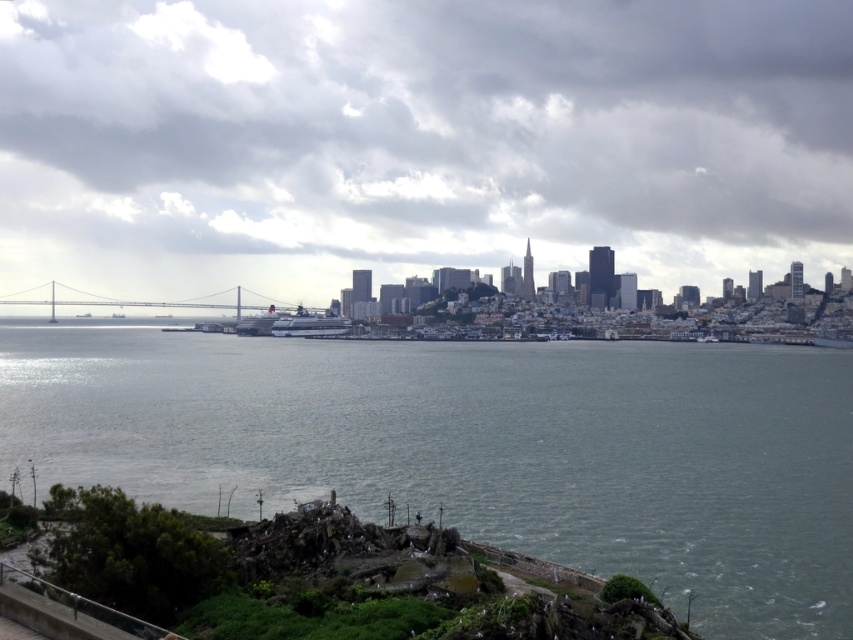
In order to click on gray water at center in this screenshot , I will do `click(479, 449)`.

Between gray water at center and metallic gray bridge at center, which one has more height?

gray water at center

Which is in front, point (20, 394) or point (108, 298)?

Positioned in front is point (20, 394).

You are a GUI agent. You are given a task and a screenshot of the screen. Output one action in this format:
    pyautogui.click(x=<x>, y=<y>)
    Task: Click on the gray water at center
    
    Given the screenshot: What is the action you would take?
    pyautogui.click(x=479, y=449)

Between cloudy sky at upper center and metallic gray bridge at center, which one appears on the right side from the viewer's perspective?

From the viewer's perspective, cloudy sky at upper center appears more on the right side.

Who is taller, cloudy sky at upper center or metallic gray bridge at center?

Standing taller between the two is cloudy sky at upper center.

You are a GUI agent. You are given a task and a screenshot of the screen. Output one action in this format:
    pyautogui.click(x=<x>, y=<y>)
    Task: Click on the cloudy sky at upper center
    The image size is (853, 640).
    Given the screenshot: What is the action you would take?
    pyautogui.click(x=418, y=140)

Image resolution: width=853 pixels, height=640 pixels. What are the coordinates of `cloudy sky at upper center` in the screenshot? It's located at (418, 140).

Is cloudy sky at upper center smaller than gray water at center?

No.

Is point (426, 125) positioned before point (241, 481)?

No, it is not.

Does point (422, 198) come in front of point (640, 577)?

No, (422, 198) is further to viewer.

Image resolution: width=853 pixels, height=640 pixels. What are the coordinates of `cloudy sky at upper center` in the screenshot? It's located at (418, 140).